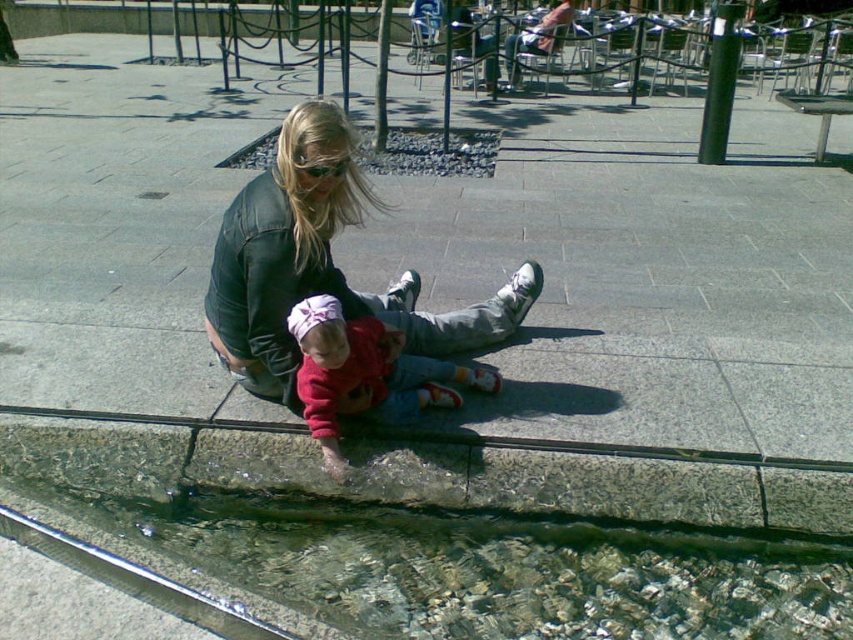
You are standing in front of the water feature and want to reach both points. Which point, point (x=273, y=182) or point (x=428, y=387), will you reach first as you move towards them?

Point (x=273, y=182) is closer to the camera than point (x=428, y=387), so you will reach point (x=273, y=182) first.

You are a photographer trying to capture a candid shot of the two people near the water. Your camera has a 10 cm depth of field. Can you focus on both the leather jacket at center and the red fleece sweater at center in the same photo?

The distance between the leather jacket at center and the red fleece sweater at center is 22.60 centimeters. Since the camera has a 10 cm depth of field, it cannot capture both objects in focus simultaneously as the distance exceeds the depth of field range.

You are designing a storage box to fit both the leather jacket at center and the matte black goggles at center. Since both items are at the center, you need to determine their sizes to ensure the box is big enough. Based on the scene description, which item requires more width in the storage box?

The leather jacket at center requires more width in the storage box because its width is larger than the matte black goggles at center.